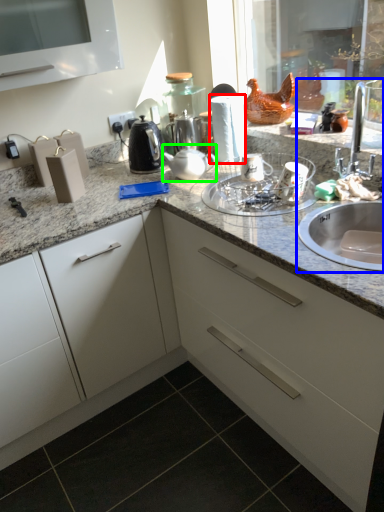
Question: Estimate the real-world distances between objects in this image. Which object is closer to paper towel (highlighted by a red box), sink (highlighted by a blue box) or tea pot (highlighted by a green box)?

Choices:
 (A) sink
 (B) tea pot

Answer: (B)